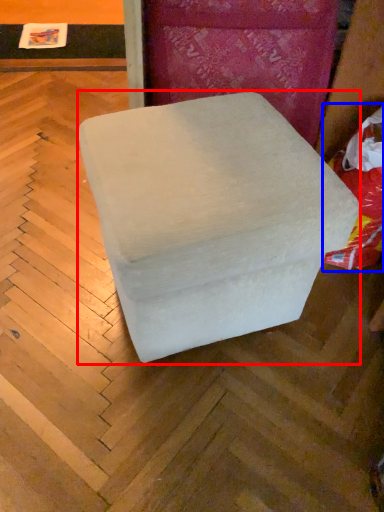
Question: Which point is further to the camera, furniture (highlighted by a red box) or bean bag chair (highlighted by a blue box)?

Choices:
 (A) furniture
 (B) bean bag chair

Answer: (B)